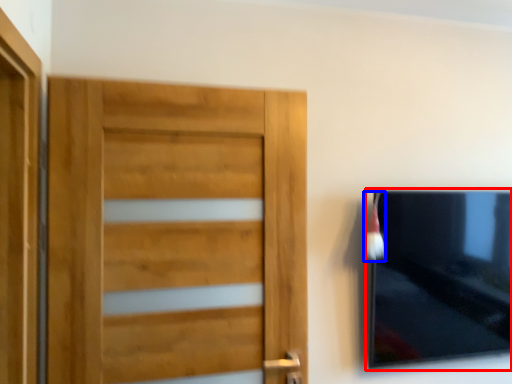
Question: Among these objects, which one is nearest to the camera, picture frame (highlighted by a red box) or brush (highlighted by a blue box)?

Choices:
 (A) picture frame
 (B) brush

Answer: (B)